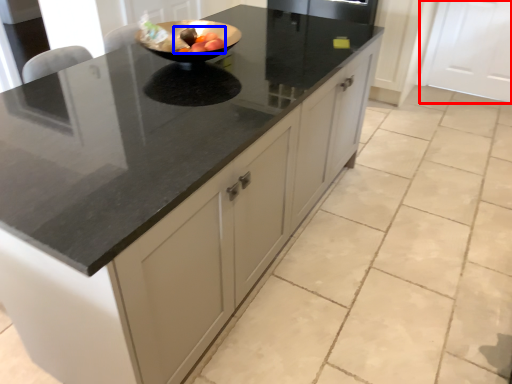
Question: Which object is closer to the camera taking this photo, cabinetry (highlighted by a red box) or fruit (highlighted by a blue box)?

Choices:
 (A) cabinetry
 (B) fruit

Answer: (B)